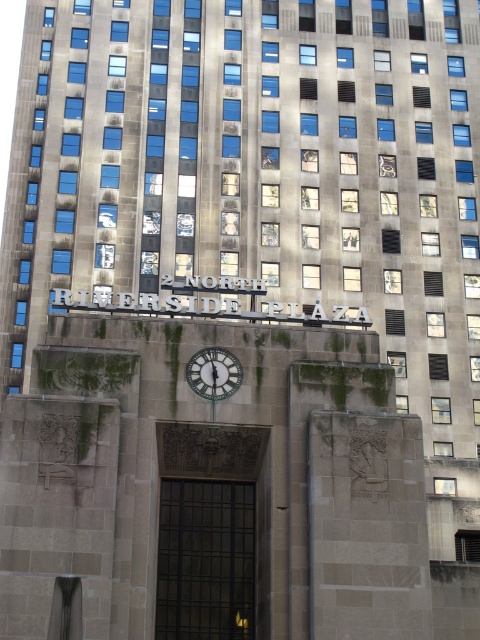
You are a delivery person trying to enter the building through the dark bronze door at center. You notice a metallic silver clock at center nearby. Which object is wider?

The dark bronze door at center is wider than the metallic silver clock at center according to the description.

You are standing in front of 2 North Riverside Plaza and need to enter the building. The entrance is marked by the dark bronze door at center. However, there is a metallic silver clock at center blocking your path. Can you walk through the clock to reach the door?

The dark bronze door at center is in front of the metallic silver clock at center, meaning the door is closer to you than the clock. Therefore, you can walk directly to the door without needing to go through the clock since the door is in front of the clock.